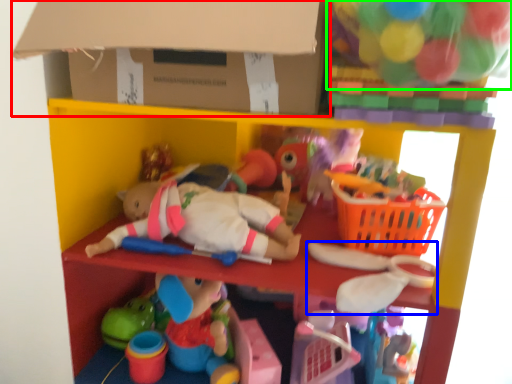
Question: Which is nearer to the cardboard box (highlighted by a red box)? toy (highlighted by a blue box) or toy (highlighted by a green box).

Choices:
 (A) toy
 (B) toy

Answer: (B)